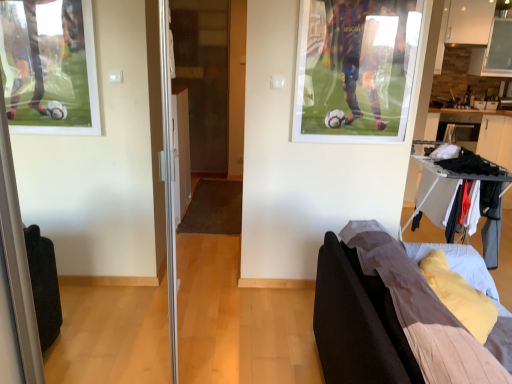
Question: Is brown fabric couch at lower right smaller than transparent glass screen door at center?

Choices:
 (A) yes
 (B) no

Answer: (B)

Question: Is brown fabric couch at lower right closer to camera compared to transparent glass screen door at center?

Choices:
 (A) yes
 (B) no

Answer: (A)

Question: Are brown fabric couch at lower right and transparent glass screen door at center beside each other?

Choices:
 (A) yes
 (B) no

Answer: (B)

Question: Considering the relative sizes of brown fabric couch at lower right and transparent glass screen door at center in the image provided, is brown fabric couch at lower right wider than transparent glass screen door at center?

Choices:
 (A) yes
 (B) no

Answer: (A)

Question: From the image's perspective, does brown fabric couch at lower right appear lower than transparent glass screen door at center?

Choices:
 (A) yes
 (B) no

Answer: (A)

Question: Considering the relative positions of brown fabric couch at lower right and transparent glass screen door at center in the image provided, is brown fabric couch at lower right to the left of transparent glass screen door at center from the viewer's perspective?

Choices:
 (A) yes
 (B) no

Answer: (B)

Question: Can you confirm if transparent glass screen door at center is thinner than brown fabric couch at lower right?

Choices:
 (A) yes
 (B) no

Answer: (A)

Question: From a real-world perspective, is transparent glass screen door at center physically below brown fabric couch at lower right?

Choices:
 (A) yes
 (B) no

Answer: (B)

Question: Does transparent glass screen door at center appear on the right side of brown fabric couch at lower right?

Choices:
 (A) yes
 (B) no

Answer: (B)

Question: Can you confirm if transparent glass screen door at center is shorter than brown fabric couch at lower right?

Choices:
 (A) no
 (B) yes

Answer: (A)

Question: From the image's perspective, is transparent glass screen door at center located beneath brown fabric couch at lower right?

Choices:
 (A) no
 (B) yes

Answer: (A)

Question: Can you confirm if transparent glass screen door at center is positioned to the left of brown fabric couch at lower right?

Choices:
 (A) no
 (B) yes

Answer: (B)

Question: Is transparent glass screen door at center taller or shorter than brown fabric couch at lower right?

Choices:
 (A) tall
 (B) short

Answer: (A)